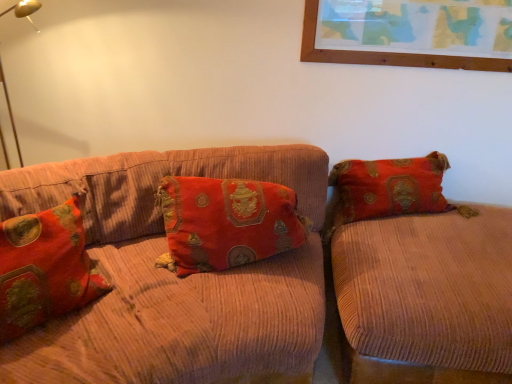
Question: Does velvet orange couch at right, which appears as the 1th studio couch when viewed from the right, have a greater height compared to velvet-like red pillow at left, the 2th pillow viewed from the right?

Choices:
 (A) yes
 (B) no

Answer: (B)

Question: From a real-world perspective, is velvet orange couch at right, the second studio couch when ordered from left to right, under velvet-like red pillow at left, the 2th pillow viewed from the right?

Choices:
 (A) yes
 (B) no

Answer: (A)

Question: Can you see velvet orange couch at right, the second studio couch when ordered from left to right, touching velvet-like red pillow at left, the 2th pillow viewed from the right?

Choices:
 (A) no
 (B) yes

Answer: (A)

Question: Does velvet orange couch at right, which appears as the 1th studio couch when viewed from the right, appear on the right side of velvet-like red pillow at left, which is the 1th pillow in left-to-right order?

Choices:
 (A) no
 (B) yes

Answer: (B)

Question: Is velvet orange couch at right, which appears as the 1th studio couch when viewed from the right, not near velvet-like red pillow at left, which is the 1th pillow in left-to-right order?

Choices:
 (A) no
 (B) yes

Answer: (B)

Question: In the image, is corduroy couch at center, the 2th studio couch positioned from the right, positioned in front of or behind velvet orange couch at right, the second studio couch when ordered from left to right?

Choices:
 (A) behind
 (B) front

Answer: (B)

Question: Considering the positions of corduroy couch at center, which is counted as the first studio couch, starting from the left, and velvet orange couch at right, which appears as the 1th studio couch when viewed from the right, in the image, is corduroy couch at center, which is counted as the first studio couch, starting from the left, bigger or smaller than velvet orange couch at right, which appears as the 1th studio couch when viewed from the right,?

Choices:
 (A) small
 (B) big

Answer: (B)

Question: Does point (135, 329) appear closer or farther from the camera than point (506, 211)?

Choices:
 (A) farther
 (B) closer

Answer: (B)

Question: From the image's perspective, relative to velvet orange couch at right, the second studio couch when ordered from left to right, is corduroy couch at center, the 2th studio couch positioned from the right, above or below?

Choices:
 (A) below
 (B) above

Answer: (B)

Question: Visually, is velvet-like red pillow at center, the second pillow positioned from the left, positioned to the left or to the right of velvet-like red pillow at left, the 2th pillow viewed from the right?

Choices:
 (A) left
 (B) right

Answer: (B)

Question: From the image's perspective, relative to velvet-like red pillow at left, the 2th pillow viewed from the right, is velvet-like red pillow at center, the second pillow positioned from the left, above or below?

Choices:
 (A) below
 (B) above

Answer: (B)

Question: Is velvet-like red pillow at center, which appears as the 1th pillow when viewed from the right, taller or shorter than velvet-like red pillow at left, which is the 1th pillow in left-to-right order?

Choices:
 (A) short
 (B) tall

Answer: (A)

Question: Does point (217, 264) appear closer or farther from the camera than point (41, 292)?

Choices:
 (A) farther
 (B) closer

Answer: (A)

Question: Considering the positions of velvet orange couch at right, the second studio couch when ordered from left to right, and corduroy couch at center, which is counted as the first studio couch, starting from the left, in the image, is velvet orange couch at right, the second studio couch when ordered from left to right, taller or shorter than corduroy couch at center, which is counted as the first studio couch, starting from the left,?

Choices:
 (A) short
 (B) tall

Answer: (A)

Question: Is velvet orange couch at right, the second studio couch when ordered from left to right, wider or thinner than corduroy couch at center, the 2th studio couch positioned from the right?

Choices:
 (A) thin
 (B) wide

Answer: (A)